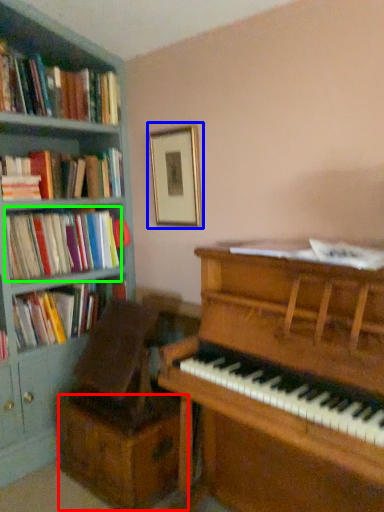
Question: Which object is positioned closest to drawer (highlighted by a red box)? Select from picture frame (highlighted by a blue box) and book (highlighted by a green box).

Choices:
 (A) picture frame
 (B) book

Answer: (B)